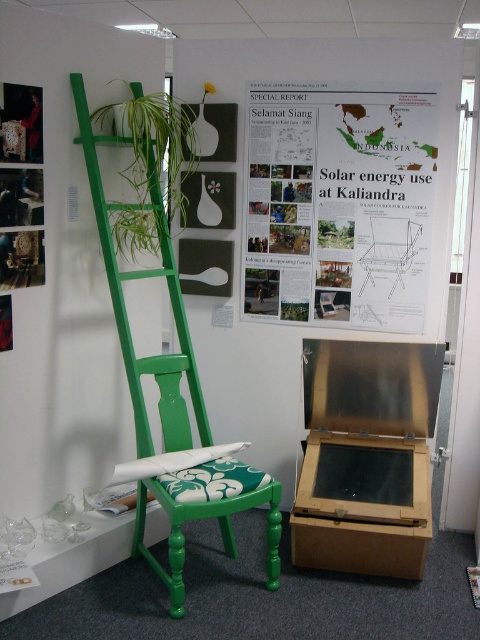
Does white paper at upper center have a larger size compared to metallic cardboard box at lower center?

Indeed, white paper at upper center has a larger size compared to metallic cardboard box at lower center.

Who is higher up, white paper at upper center or metallic cardboard box at lower center?

white paper at upper center

Is point (317, 150) less distant than point (412, 381)?

No, it is not.

Where is `white paper at upper center`? white paper at upper center is located at coordinates (338, 204).

Between metallic cardboard box at lower center and green painted wood chair at center, which one has more height?

green painted wood chair at center is taller.

Does metallic cardboard box at lower center have a lesser width compared to green painted wood chair at center?

No, metallic cardboard box at lower center is not thinner than green painted wood chair at center.

Between point (409, 406) and point (167, 362), which one is positioned behind?

Point (409, 406)

Find the location of `metallic cardboard box at lower center`. metallic cardboard box at lower center is located at coordinates pyautogui.click(x=365, y=456).

The height and width of the screenshot is (640, 480). I want to click on white paper at upper center, so click(338, 204).

Between point (305, 120) and point (276, 538), which one is positioned in front?

Point (276, 538) is in front.

Identify the location of white paper at upper center. The image size is (480, 640). (338, 204).